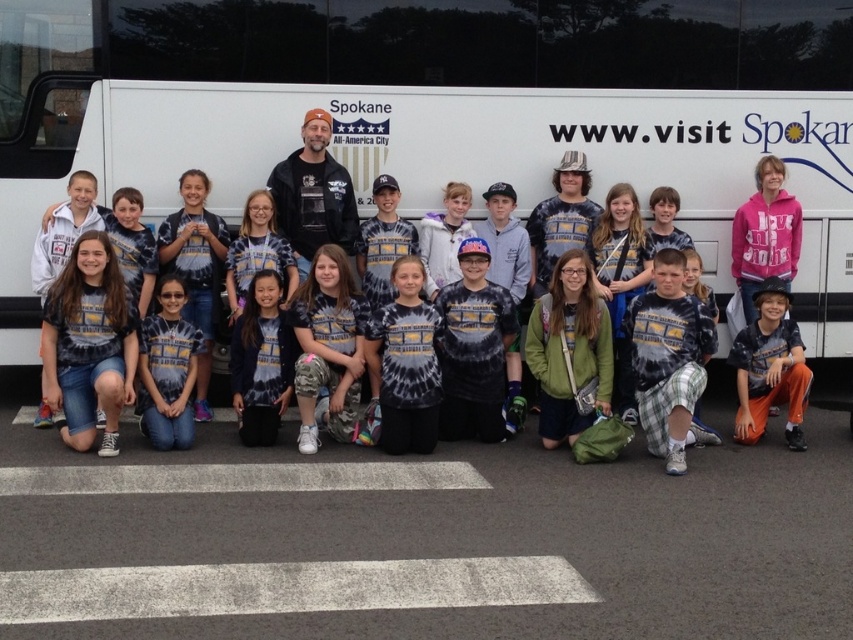
You are standing in front of the large white bus with the group of people. There are two points marked on the bus at coordinates point (575, 268) and point (746, 300). Which point is closer to you?

Point (575, 268) is closer to the viewer than point (746, 300).